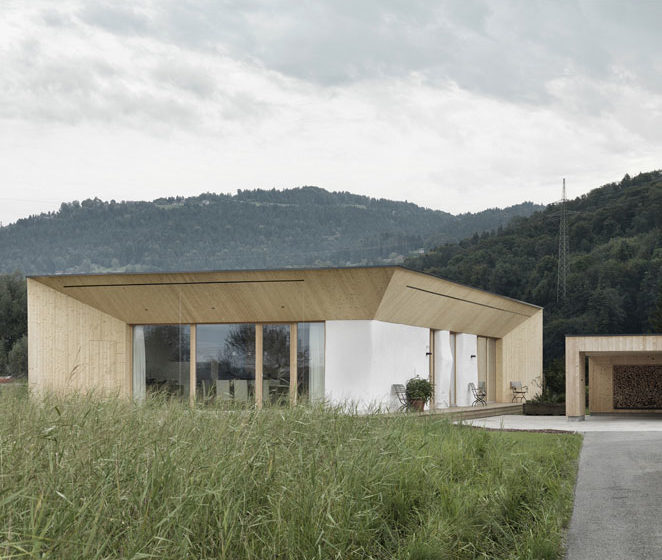
I want to click on side wall, so click(341, 379).